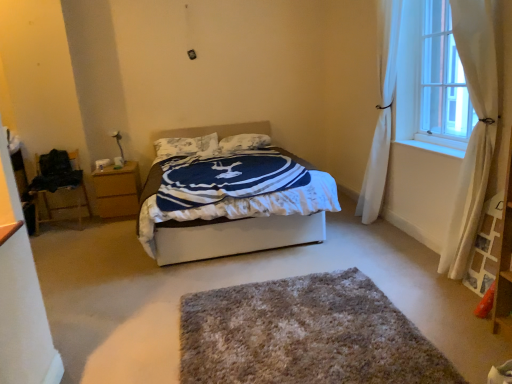
Identify the location of vacant area that lies between white sheer curtain at right, which is the 1th curtain in back-to-front order, and shaggy gray rug at center. (349, 267).